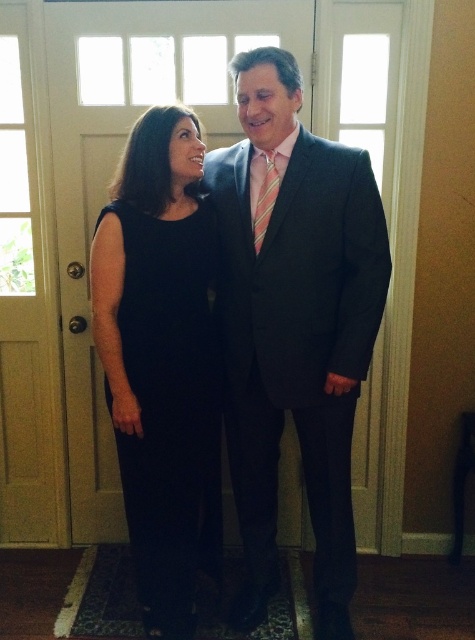
In the scene shown: You are a photographer setting up for an event. You need to position two models wearing the black satin dress at center and the black satin dress at left. The venue has a narrow runway that can only accommodate one model at a time. Which model should you place first if you want to photograph them both without overlapping?

The black satin dress at left should be placed first because it is smaller in size than the black satin dress at center, allowing more space for the larger dress afterward.

You are standing in front of the double door with glass panels and see two points marked in the scene. The first point is at coordinate point (334,545) and the second point is at coordinate point (268,152). Which point is closer to the double door?

Point (268,152) is closer to the double door because point (334,545) is behind it.